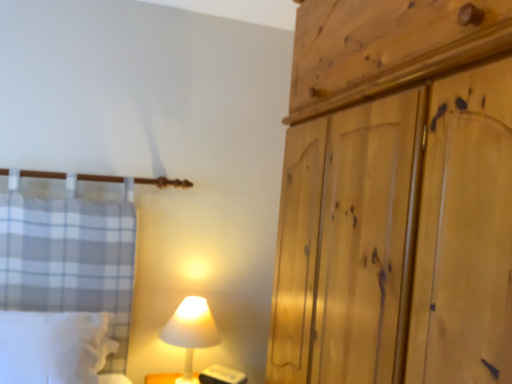
Find the location of a particular element. The width and height of the screenshot is (512, 384). white soft pillow at lower left is located at coordinates (54, 346).

Is natural wood wardrobe at right surrounded by white matte lamp at lower center?

Definitely not — natural wood wardrobe at right is not inside white matte lamp at lower center.

Between white matte lamp at lower center and natural wood wardrobe at right, which one is positioned in front?

natural wood wardrobe at right.

At what (x,y) coordinates should I click in order to perform the action: click on lamp located on the left of natural wood wardrobe at right. Please return your answer as a coordinate pair (x, y). Looking at the image, I should click on (191, 332).

What's the angular difference between white matte lamp at lower center and natural wood wardrobe at right's facing directions?

There is a 89.7-degree angle between the facing directions of white matte lamp at lower center and natural wood wardrobe at right.

From the image's perspective, is natural wood wardrobe at right above white matte lamp at lower center?

Correct, natural wood wardrobe at right appears higher than white matte lamp at lower center in the image.

Is natural wood wardrobe at right aimed at white matte lamp at lower center?

No, natural wood wardrobe at right does not turn towards white matte lamp at lower center.

Which of these two, natural wood wardrobe at right or white matte lamp at lower center, stands shorter?

With less height is white matte lamp at lower center.

Can you confirm if natural wood wardrobe at right is thinner than white matte lamp at lower center?

No.

Considering their positions, is natural wood wardrobe at right located in front of or behind white soft pillow at lower left?

natural wood wardrobe at right is in front of white soft pillow at lower left.

Is point (337, 207) closer to camera compared to point (64, 320)?

Yes, it is.

Does natural wood wardrobe at right have a larger size compared to white soft pillow at lower left?

Indeed, natural wood wardrobe at right has a larger size compared to white soft pillow at lower left.

From a real-world perspective, is natural wood wardrobe at right on white soft pillow at lower left?

Indeed, from a real-world perspective, natural wood wardrobe at right stands above white soft pillow at lower left.

Would you say natural wood wardrobe at right is part of white soft pillow at lower left's contents?

No, white soft pillow at lower left does not contain natural wood wardrobe at right.

Between white soft pillow at lower left and natural wood wardrobe at right, which one appears on the right side from the viewer's perspective?

From the viewer's perspective, natural wood wardrobe at right appears more on the right side.

Can you confirm if white soft pillow at lower left is wider than natural wood wardrobe at right?

In fact, white soft pillow at lower left might be narrower than natural wood wardrobe at right.

Which is farther, [105,322] or [311,256]?

The point [105,322] is farther from the camera.

Is white soft pillow at lower left inside or outside of white matte lamp at lower center?

white soft pillow at lower left cannot be found inside white matte lamp at lower center.

Which point is more distant from viewer, (65, 371) or (191, 344)?

The point (191, 344) is farther.

Does white soft pillow at lower left touch white matte lamp at lower center?

No.

From the picture: Which is less distant, (x=188, y=320) or (x=12, y=340)?

Point (x=188, y=320) is farther from the camera than point (x=12, y=340).

What's the angular difference between white matte lamp at lower center and white soft pillow at lower left's facing directions?

The angular difference between white matte lamp at lower center and white soft pillow at lower left is 0.000405 degrees.

Does white matte lamp at lower center have a greater height compared to white soft pillow at lower left?

Indeed, white matte lamp at lower center has a greater height compared to white soft pillow at lower left.

The height and width of the screenshot is (384, 512). What are the coordinates of `lamp located behind the natural wood wardrobe at right` in the screenshot? It's located at (191, 332).

Image resolution: width=512 pixels, height=384 pixels. In order to click on lamp that appears on the left of natural wood wardrobe at right in this screenshot , I will do `click(191, 332)`.

Considering their positions, is natural wood wardrobe at right positioned further to white matte lamp at lower center than white soft pillow at lower left?

natural wood wardrobe at right is positioned further to the anchor white matte lamp at lower center.

Based on their spatial positions, is white matte lamp at lower center or white soft pillow at lower left closer to natural wood wardrobe at right?

white matte lamp at lower center.

When comparing their distances from white soft pillow at lower left, does white matte lamp at lower center or natural wood wardrobe at right seem closer?

Based on the image, white matte lamp at lower center appears to be nearer to white soft pillow at lower left.

Based on the photo, looking at the image, which one is located further to white soft pillow at lower left, natural wood wardrobe at right or white matte lamp at lower center?

natural wood wardrobe at right lies further to white soft pillow at lower left than the other object.

From the image, which object appears to be farther from natural wood wardrobe at right, white soft pillow at lower left or white matte lamp at lower center?

white soft pillow at lower left is positioned further to the anchor natural wood wardrobe at right.

From the picture: Considering their positions, is white soft pillow at lower left positioned closer to white matte lamp at lower center than natural wood wardrobe at right?

white soft pillow at lower left lies closer to white matte lamp at lower center than the other object.

Find the location of `lamp between white soft pillow at lower left and natural wood wardrobe at right from left to right`. lamp between white soft pillow at lower left and natural wood wardrobe at right from left to right is located at coordinates (191, 332).